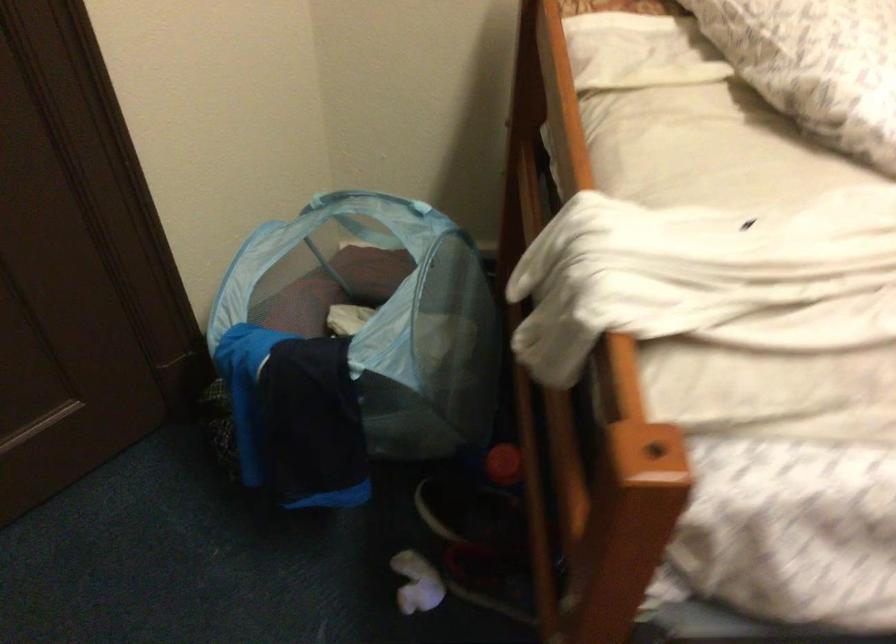
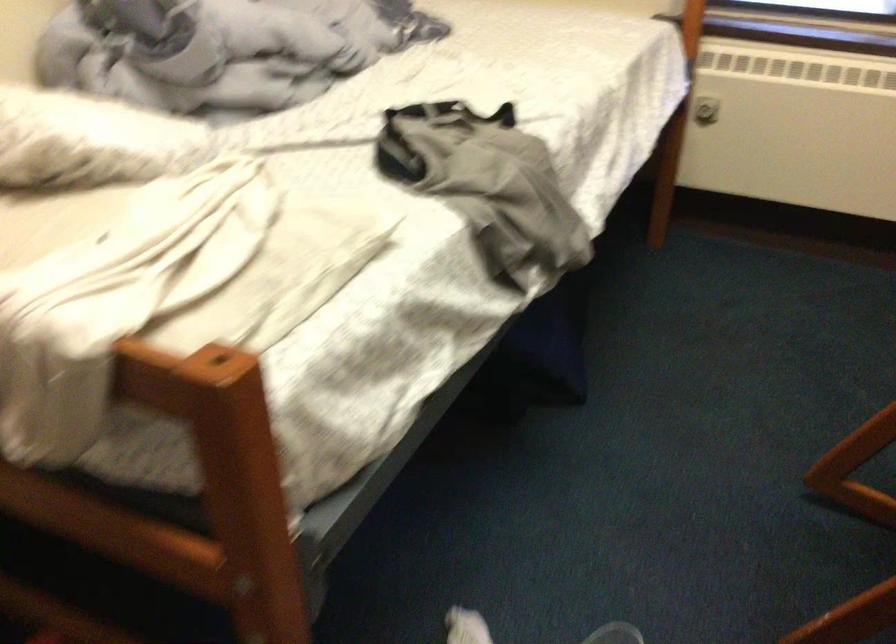
Question: The camera is either moving clockwise (left) or counter-clockwise (right) around the object. The first image is from the beginning of the video and the second image is from the end. Is the camera moving left or right when shooting the video?

Choices:
 (A) Left
 (B) Right

Answer: (A)